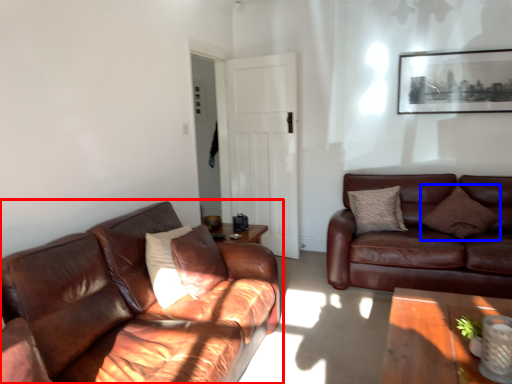
Question: Among these objects, which one is farthest to the camera, studio couch (highlighted by a red box) or pillow (highlighted by a blue box)?

Choices:
 (A) studio couch
 (B) pillow

Answer: (B)